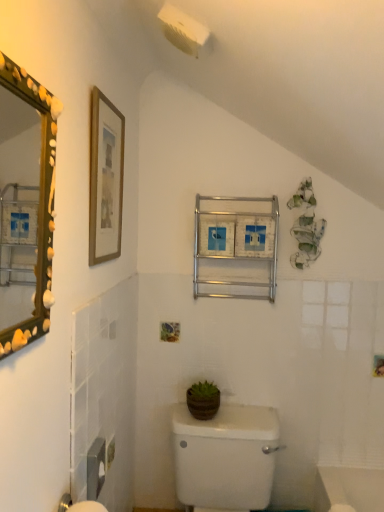
Question: From a real-world perspective, is wooden framed print at upper left physically located above or below green matte pot at center?

Choices:
 (A) above
 (B) below

Answer: (A)

Question: Is wooden framed print at upper left to the left or to the right of green matte pot at center in the image?

Choices:
 (A) left
 (B) right

Answer: (A)

Question: Estimate the real-world distances between objects in this image. Which object is farther from the white glossy toilet at center?

Choices:
 (A) green matte pot at center
 (B) wooden framed print at upper left
 (C) metallic silver medicine cabinet at center

Answer: (B)

Question: Considering the real-world distances, which object is closest to the white glossy toilet at center?

Choices:
 (A) green matte pot at center
 (B) wooden framed print at upper left
 (C) metallic silver medicine cabinet at center

Answer: (A)